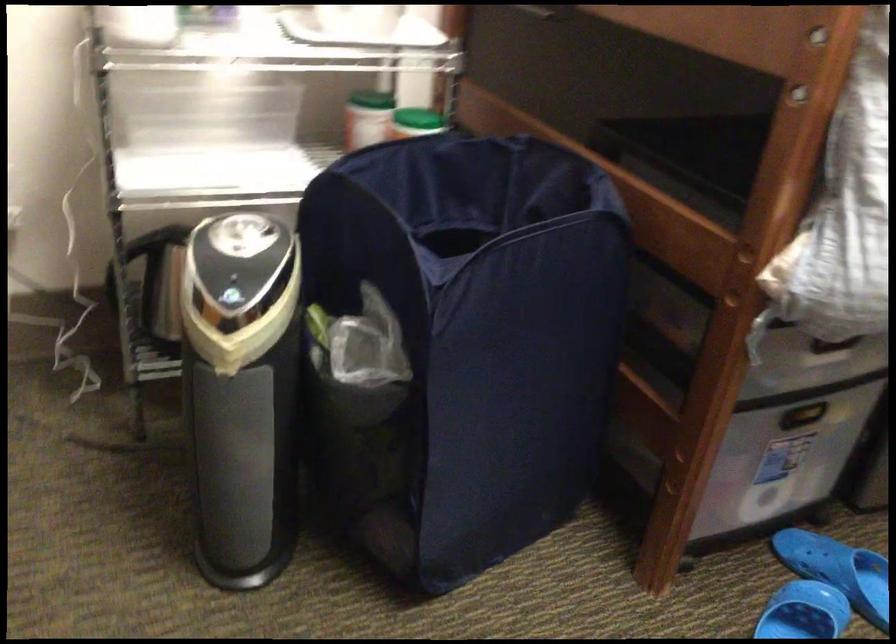
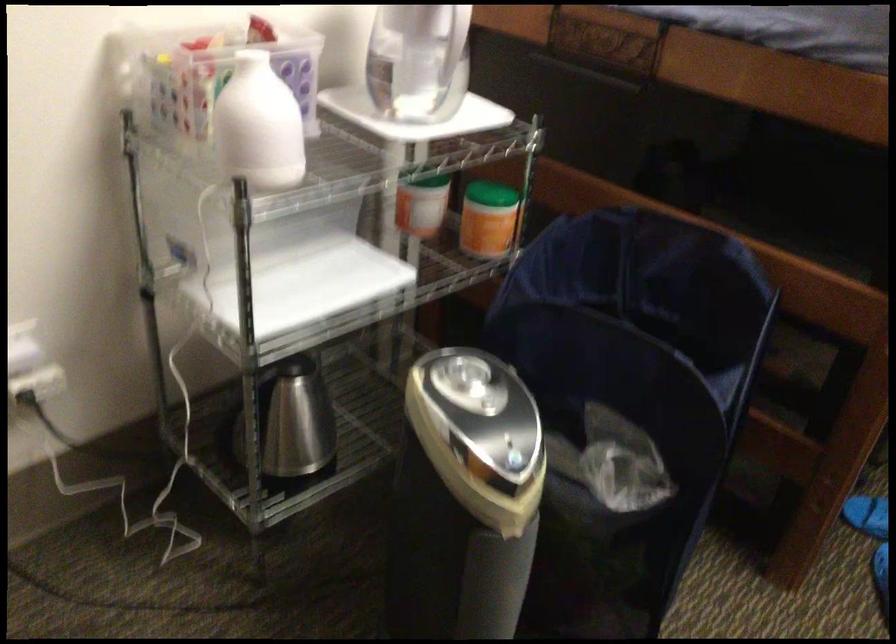
Question: The camera is either moving clockwise (left) or counter-clockwise (right) around the object. The first image is from the beginning of the video and the second image is from the end. Is the camera moving left or right when shooting the video?

Choices:
 (A) Left
 (B) Right

Answer: (A)